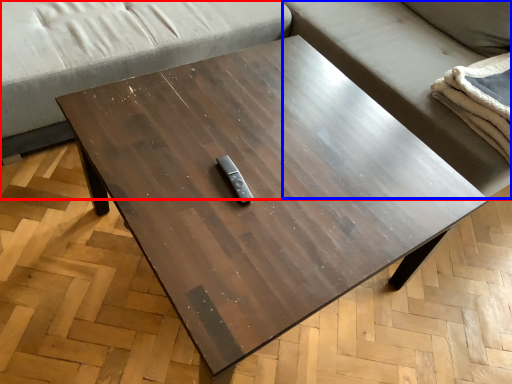
Question: Which point is closer to the camera, studio couch (highlighted by a red box) or couch (highlighted by a blue box)?

Choices:
 (A) studio couch
 (B) couch

Answer: (A)